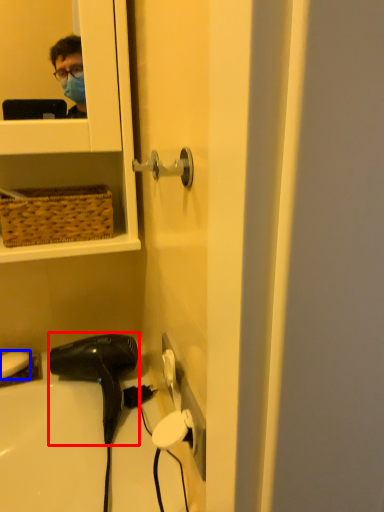
Question: Which of the following is the closest to the observer, hair drier (highlighted by a red box) or soap (highlighted by a blue box)?

Choices:
 (A) hair drier
 (B) soap

Answer: (A)